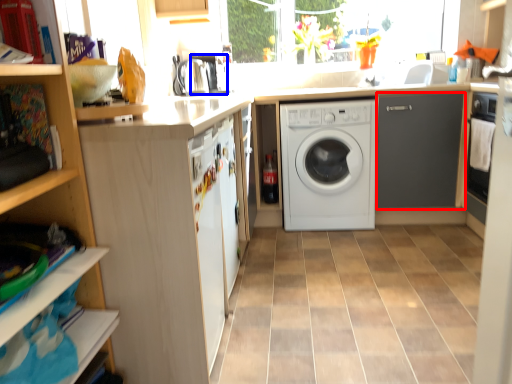
Question: Which point is closer to the camera, cabinetry (highlighted by a red box) or coffee machine (highlighted by a blue box)?

Choices:
 (A) cabinetry
 (B) coffee machine

Answer: (A)